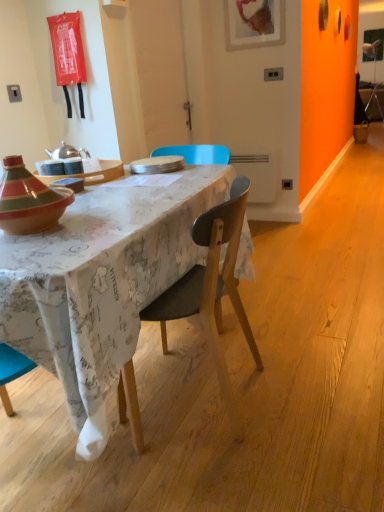
At what (x,y) coordinates should I click in order to perform the action: click on vacant space in front of wooden chair at center. Please return your answer as a coordinate pair (x, y). The height and width of the screenshot is (512, 384). Looking at the image, I should click on (209, 472).